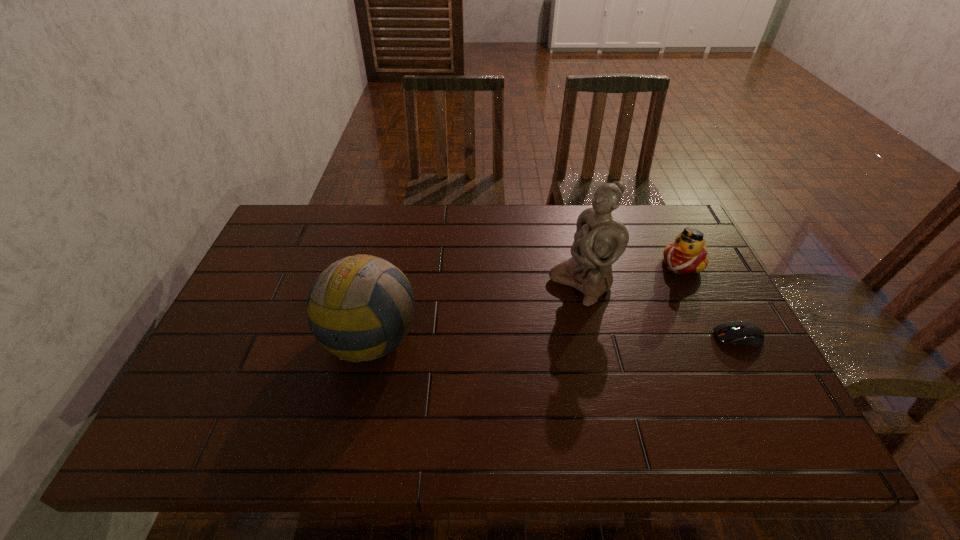
This screenshot has height=540, width=960. Find the location of `free space between the figurine and the shortest object`. free space between the figurine and the shortest object is located at coordinates (660, 311).

Identify the location of unoccupied area between the computer equipment and the third shortest object. click(553, 336).

Image resolution: width=960 pixels, height=540 pixels. I want to click on free space between the computer equipment and the third shortest object, so click(x=553, y=336).

You are a GUI agent. You are given a task and a screenshot of the screen. Output one action in this format:
    pyautogui.click(x=<x>, y=<y>)
    Task: Click on the free spot between the second shortest object and the leftmost object
    
    Given the screenshot: What is the action you would take?
    pyautogui.click(x=525, y=300)

This screenshot has height=540, width=960. In order to click on unoccupied area between the computer equipment and the leftmost object in this screenshot , I will do `click(553, 336)`.

Where is `unoccupied area between the second object from left to right and the shortest object`? The image size is (960, 540). unoccupied area between the second object from left to right and the shortest object is located at coordinates (660, 311).

This screenshot has width=960, height=540. I want to click on vacant space that's between the duck and the computer equipment, so coord(710,300).

Find the location of a particular element. The image size is (960, 540). empty space that is in between the computer equipment and the third shortest object is located at coordinates (553, 336).

Where is `object that ranks as the third closest to the shortest object`? object that ranks as the third closest to the shortest object is located at coordinates click(x=360, y=305).

Identify the location of object that is the nearest to the computer equipment. (688, 254).